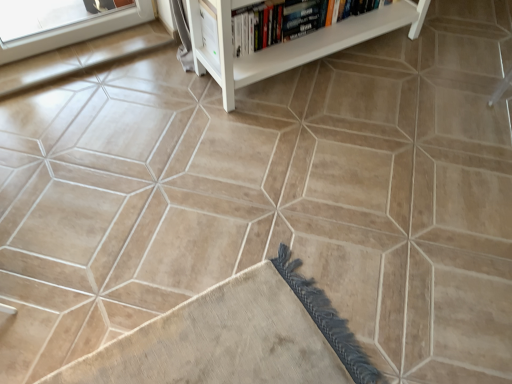
At what (x,y) coordinates should I click in order to perform the action: click on free space in front of white matte shelf at upper center. Please return your answer as a coordinate pair (x, y). The height and width of the screenshot is (384, 512). Looking at the image, I should click on (324, 160).